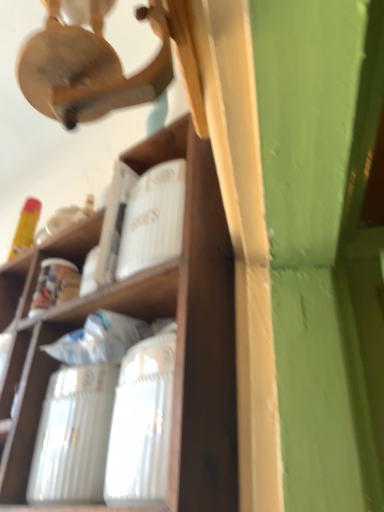
The image size is (384, 512). What do you see at coordinates (148, 320) in the screenshot? I see `wooden shelf at upper center` at bounding box center [148, 320].

The width and height of the screenshot is (384, 512). I want to click on wooden shelf at upper center, so click(x=148, y=320).

Locate an element on the screen. The width and height of the screenshot is (384, 512). wooden shelf at upper center is located at coordinates click(x=148, y=320).